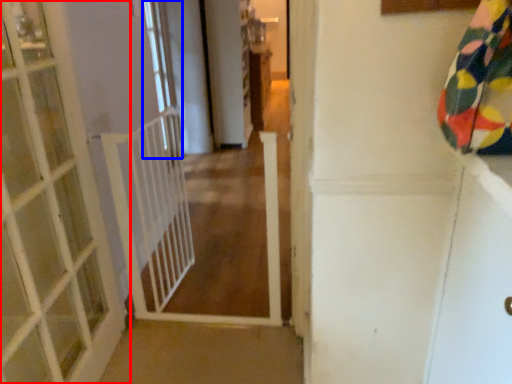
Question: Which object appears farthest to the camera in this image, door (highlighted by a red box) or window (highlighted by a blue box)?

Choices:
 (A) door
 (B) window

Answer: (B)